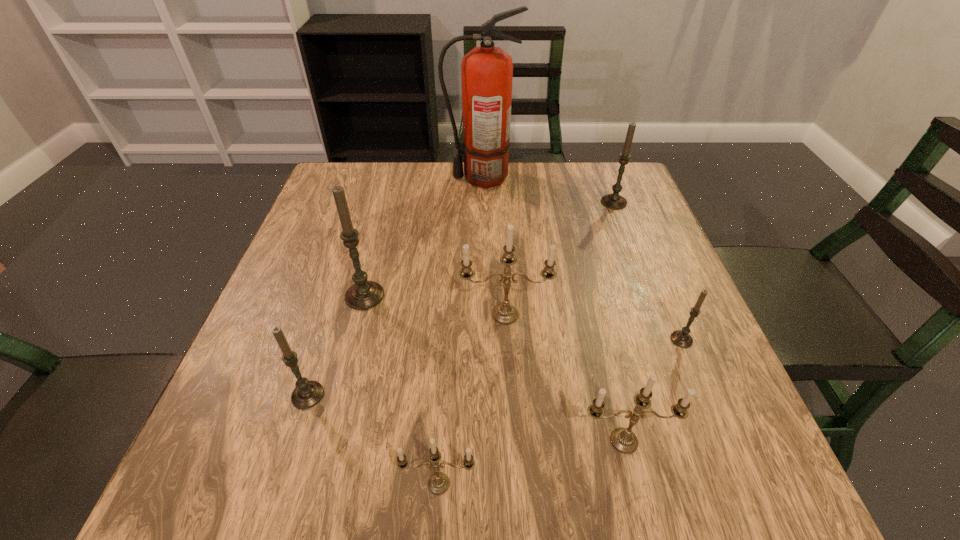
I want to click on unoccupied position between the farthest metallic candle and the farthest gray candle, so click(x=560, y=258).

Where is `vacant space that is in between the tallest object and the seventh nearest object`? vacant space that is in between the tallest object and the seventh nearest object is located at coordinates (547, 190).

You are a GUI agent. You are given a task and a screenshot of the screen. Output one action in this format:
    pyautogui.click(x=<x>, y=<y>)
    Task: Click on the vacant point located between the farthest metallic candle and the third farthest gray candle
    This screenshot has height=540, width=960.
    Given the screenshot: What is the action you would take?
    pyautogui.click(x=593, y=327)

I want to click on vacant area that lies between the second nearest candle and the seventh shortest object, so click(494, 368).

This screenshot has height=540, width=960. Identify the location of free spot between the fifth farthest object and the biggest gray candle. (523, 318).

Point out which object is positioned as the third nearest to the farthest candle. Please provide its 2D coordinates. Your answer should be formatted as a tuple, i.e. [(x, y)], where the tuple contains the x and y coordinates of a point satisfying the conditions above.

[(680, 338)]

Select which object appears as the second closest to the nearest gray candle. Please provide its 2D coordinates. Your answer should be formatted as a tuple, i.e. [(x, y)], where the tuple contains the x and y coordinates of a point satisfying the conditions above.

[(438, 483)]

Identify which candle is the nearest to the farthest metallic candle. Please provide its 2D coordinates. Your answer should be formatted as a tuple, i.e. [(x, y)], where the tuple contains the x and y coordinates of a point satisfying the conditions above.

[(362, 295)]

Select which candle appears as the closest to the smallest metallic candle. Please provide its 2D coordinates. Your answer should be formatted as a tuple, i.e. [(x, y)], where the tuple contains the x and y coordinates of a point satisfying the conditions above.

[(622, 439)]

Point out which gray candle is positioned as the second nearest to the seventh farthest object. Please provide its 2D coordinates. Your answer should be formatted as a tuple, i.e. [(x, y)], where the tuple contains the x and y coordinates of a point satisfying the conditions above.

[(307, 394)]